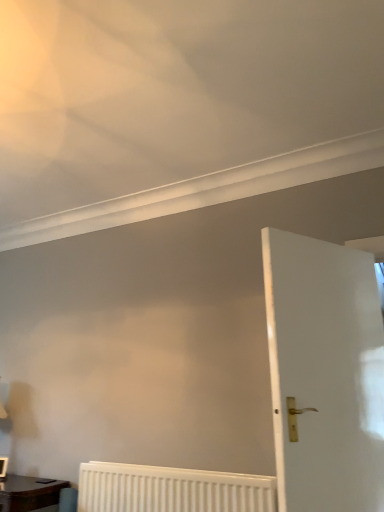
Where is `matte brown wooden table at lower left`? matte brown wooden table at lower left is located at coordinates (29, 493).

Describe the element at coordinates (325, 373) in the screenshot. I see `white glossy door at right` at that location.

Find the location of `white textured radiator at lower center`. white textured radiator at lower center is located at coordinates (171, 489).

The width and height of the screenshot is (384, 512). I want to click on matte brown wooden table at lower left, so click(29, 493).

From the picture: Is matte brown wooden table at lower left taller or shorter than white textured radiator at lower center?

In the image, matte brown wooden table at lower left appears to be shorter than white textured radiator at lower center.

Is matte brown wooden table at lower left outside of white textured radiator at lower center?

Yes.

Find the location of `table below the white textured radiator at lower center (from a real-world perspective)`. table below the white textured radiator at lower center (from a real-world perspective) is located at coordinates pos(29,493).

Identify the location of radiator that is on the left side of white glossy door at right. (171, 489).

Is white glossy door at right at the left side of white textured radiator at lower center?

No.

Is white glossy door at right facing away from white textured radiator at lower center?

Yes.

Is white glossy door at right inside the boundaries of white textured radiator at lower center, or outside?

white glossy door at right is not enclosed by white textured radiator at lower center.

How distant is white textured radiator at lower center from matte brown wooden table at lower left?

The distance of white textured radiator at lower center from matte brown wooden table at lower left is 23.12 inches.

Based on the photo, can you tell me how much white textured radiator at lower center and matte brown wooden table at lower left differ in facing direction?

0.34 degrees.

Which is in front, white textured radiator at lower center or matte brown wooden table at lower left?

Positioned in front is white textured radiator at lower center.

Which is in front, point (151, 483) or point (56, 480)?

The point (151, 483) is in front.

How different are the orientations of white textured radiator at lower center and white glossy door at right in degrees?

The facing directions of white textured radiator at lower center and white glossy door at right are 60.4 degrees apart.

In the scene shown: From a real-world perspective, is white textured radiator at lower center positioned above or below white glossy door at right?

In terms of real-world spatial position, white textured radiator at lower center is below white glossy door at right.

From the picture: Is white textured radiator at lower center looking in the opposite direction of white glossy door at right?

No, white glossy door at right is not at the back of white textured radiator at lower center.

From the image's perspective, is white textured radiator at lower center located beneath white glossy door at right?

Yes, from the image's perspective, white textured radiator at lower center is below white glossy door at right.

The height and width of the screenshot is (512, 384). Identify the location of door above the matte brown wooden table at lower left (from a real-world perspective). (325, 373).

Is matte brown wooden table at lower left a part of white glossy door at right?

No, matte brown wooden table at lower left is not inside white glossy door at right.

Which object is thinner, white glossy door at right or matte brown wooden table at lower left?

white glossy door at right is thinner.

In order to click on door in front of the matte brown wooden table at lower left in this screenshot , I will do `click(325, 373)`.

Does point (21, 497) appear closer or farther from the camera than point (285, 340)?

Clearly, point (21, 497) is more distant from the camera than point (285, 340).

Between matte brown wooden table at lower left and white glossy door at right, which one has more height?

white glossy door at right.

I want to click on table behind the white textured radiator at lower center, so click(x=29, y=493).

I want to click on radiator below the white glossy door at right (from the image's perspective), so click(171, 489).

Considering their positions, is matte brown wooden table at lower left positioned closer to white textured radiator at lower center than white glossy door at right?

matte brown wooden table at lower left is positioned closer to the anchor white textured radiator at lower center.

Based on their spatial positions, is white textured radiator at lower center or matte brown wooden table at lower left further from white glossy door at right?

Based on the image, matte brown wooden table at lower left appears to be further to white glossy door at right.

Estimate the real-world distances between objects in this image. Which object is closer to white textured radiator at lower center, white glossy door at right or matte brown wooden table at lower left?

matte brown wooden table at lower left is closer to white textured radiator at lower center.

Considering their positions, is white glossy door at right positioned closer to matte brown wooden table at lower left than white textured radiator at lower center?

The object closer to matte brown wooden table at lower left is white textured radiator at lower center.

Based on their spatial positions, is matte brown wooden table at lower left or white textured radiator at lower center closer to white glossy door at right?

white textured radiator at lower center is closer to white glossy door at right.

From the image, which object appears to be farther from matte brown wooden table at lower left, white textured radiator at lower center or white glossy door at right?

white glossy door at right is further to matte brown wooden table at lower left.

Identify the location of radiator situated between matte brown wooden table at lower left and white glossy door at right from left to right. This screenshot has height=512, width=384. (171, 489).